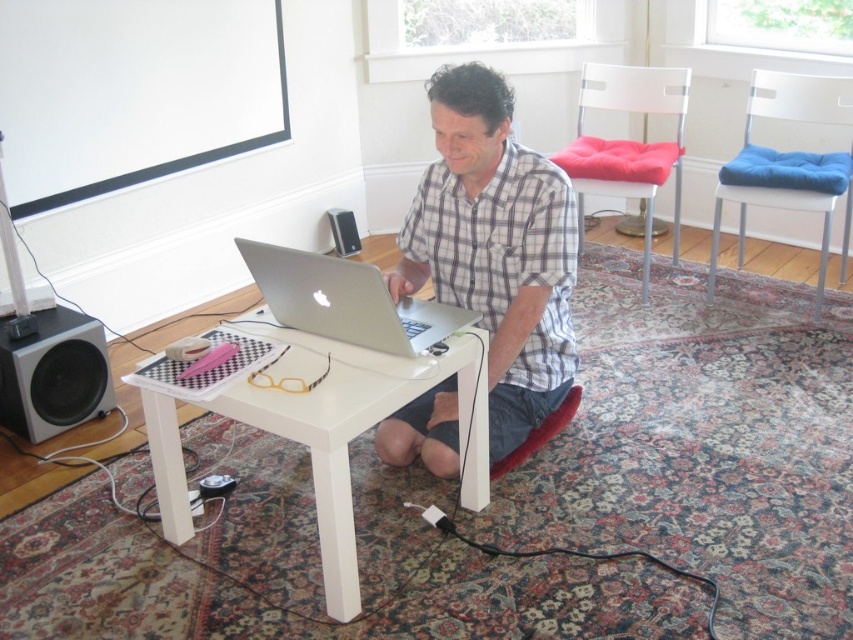
Question: Is silver metallic laptop at center bigger than black matte speaker at lower left?

Choices:
 (A) yes
 (B) no

Answer: (A)

Question: Among these objects, which one is nearest to the camera?

Choices:
 (A) silver metallic laptop at center
 (B) white checkered shirt at center
 (C) black matte speaker at lower left
 (D) white glossy table at center

Answer: (D)

Question: Does white glossy table at center appear on the right side of black plastic speaker at lower left?

Choices:
 (A) yes
 (B) no

Answer: (A)

Question: Which object appears closest to the camera in this image?

Choices:
 (A) white glossy table at center
 (B) white checkered shirt at center
 (C) silver metallic laptop at center
 (D) black matte speaker at lower left

Answer: (A)

Question: Which point is farther to the camera?

Choices:
 (A) white checkered shirt at center
 (B) silver metallic laptop at center

Answer: (A)

Question: Is white checkered shirt at center positioned at the back of black plastic speaker at lower left?

Choices:
 (A) no
 (B) yes

Answer: (A)